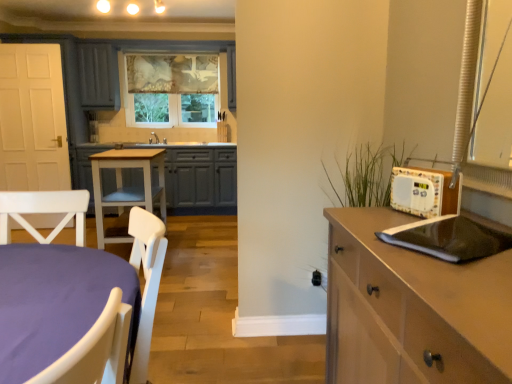
Question: From a real-world perspective, is light brown wood cabinet at right, which appears as the second cabinetry when viewed from the left, positioned above or below black matte laptop at right?

Choices:
 (A) above
 (B) below

Answer: (B)

Question: From the image's perspective, is light brown wood cabinet at right, which ranks as the 1th cabinetry in bottom-to-top order, located above or below black matte laptop at right?

Choices:
 (A) below
 (B) above

Answer: (A)

Question: Estimate the real-world distances between objects in this image. Which object is closer to the light brown wood cabinet at right, positioned as the 2th cabinetry in back-to-front order?

Choices:
 (A) white wood table at center
 (B) textured fabric window at center
 (C) matte gray cabinet at center, positioned as the first cabinetry in top-to-bottom order
 (D) black matte laptop at right

Answer: (D)

Question: Estimate the real-world distances between objects in this image. Which object is farther from the light brown wood cabinet at right, which is the 2th cabinetry from top to bottom?

Choices:
 (A) black matte laptop at right
 (B) white wood table at center
 (C) textured fabric window at center
 (D) matte gray cabinet at center, which appears as the second cabinetry when viewed from the front

Answer: (C)